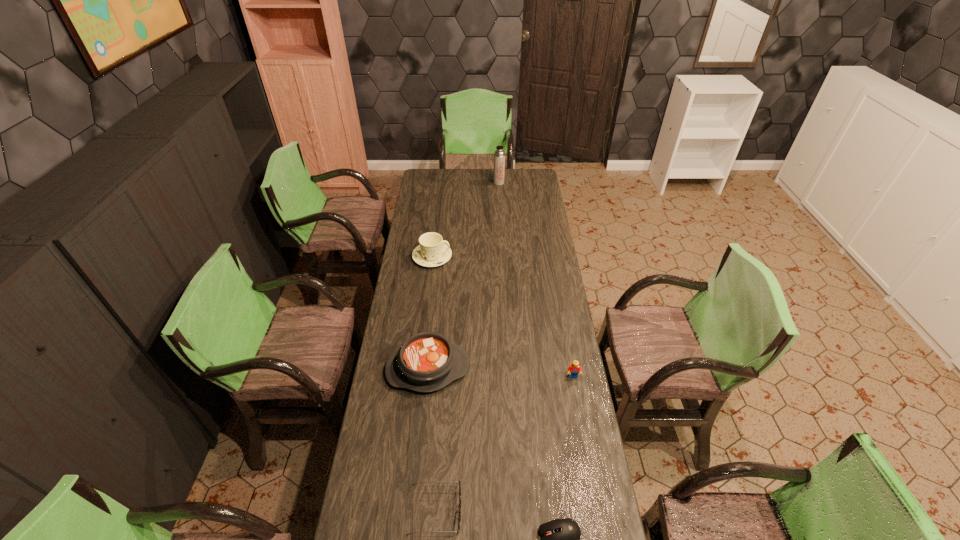
Locate an element on the screen. The width and height of the screenshot is (960, 540). free spot between the farthest object and the chinaware is located at coordinates (466, 220).

Image resolution: width=960 pixels, height=540 pixels. What are the coordinates of `vacant space that's between the tallest object and the Lego` in the screenshot? It's located at (536, 280).

Image resolution: width=960 pixels, height=540 pixels. Identify the location of free point between the chinaware and the third shortest object. (503, 316).

Identify the location of vacant space in between the thermos bottle and the casserole. (464, 276).

Locate an element on the screen. The height and width of the screenshot is (540, 960). object that ranks as the third closest to the spectacles is located at coordinates tap(573, 370).

This screenshot has width=960, height=540. In order to click on object that is the nearest to the thermos bottle in this screenshot , I will do `click(432, 252)`.

Find the location of a particular element. The image size is (960, 540). free region that satisfies the following two spatial constraints: 1. on the front side of the tallest object; 2. on the handle side of the fifth nearest object is located at coordinates (503, 257).

This screenshot has height=540, width=960. Identify the location of free location that satisfies the following two spatial constraints: 1. on the handle side of the chinaware; 2. on the back side of the casserole. (419, 369).